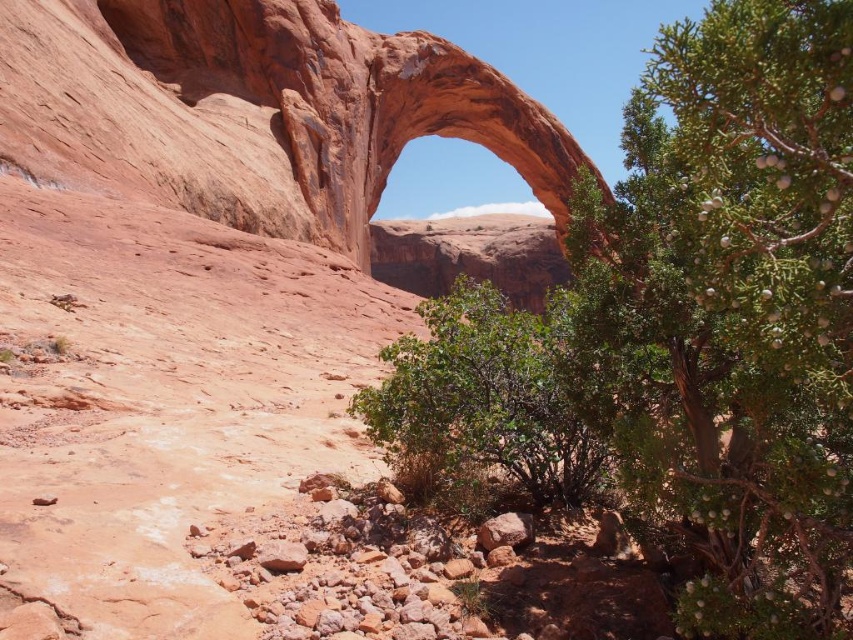
Is green leafy tree at center below rustic sandstone arch at center?

→ Yes.

Does point (737, 88) lie in front of point (407, 252)?

Yes, it is.

Where is `green leafy tree at center`? The width and height of the screenshot is (853, 640). green leafy tree at center is located at coordinates (730, 312).